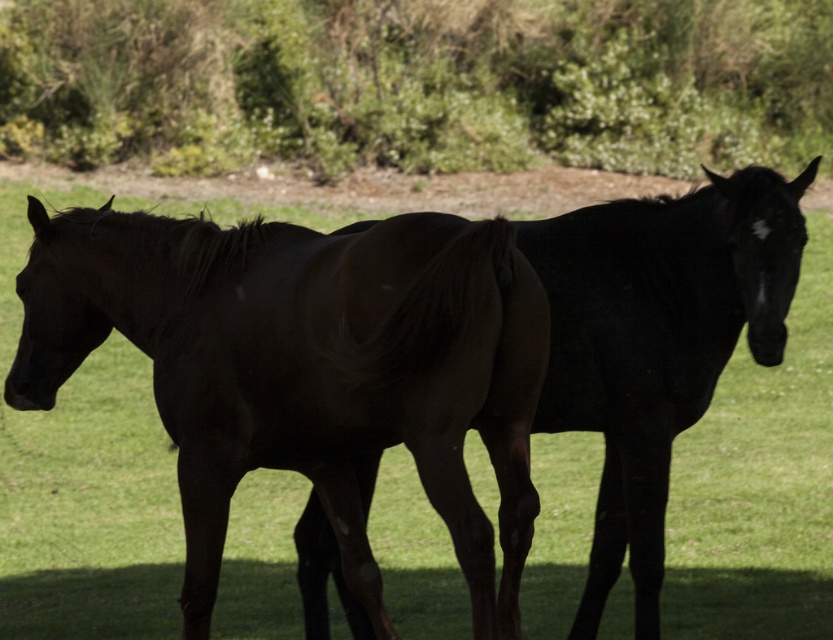
You are a photographer setting up a shot of the two horses in the field. You want to position your camera so that the shiny black horse at left is centered in the frame. If you do this, will the green leafy bush at upper center be to the left or right of the horse in the final image?

The green leafy bush at upper center is to the right of the shiny black horse at left, so when the camera is positioned to center the shiny black horse at left, the bush will appear to the right of the horse in the final image.

You are standing in the field looking at the two horses. Which of the two points, point [135,305] or point [532,252], is closer to you?

Point [135,305] is closer to the viewer than point [532,252].